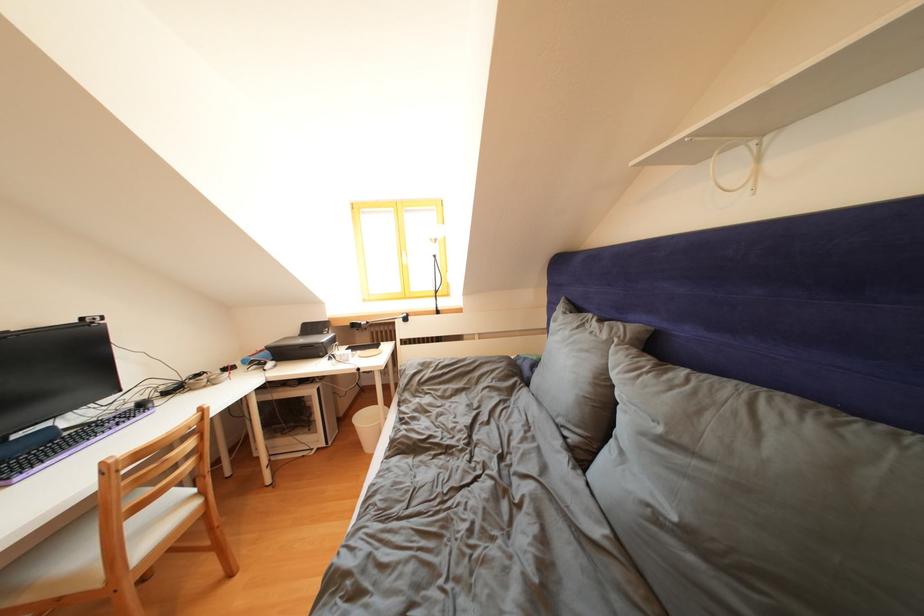
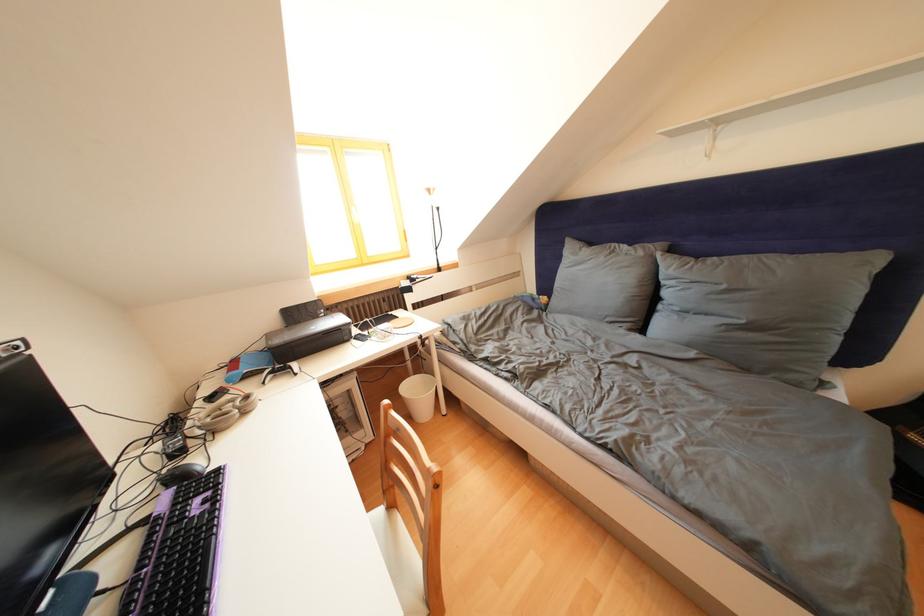
The point at (667, 435) is marked in the first image. Where is the corresponding point in the second image?

(733, 292)